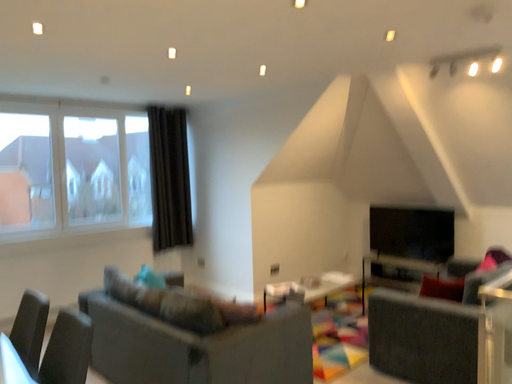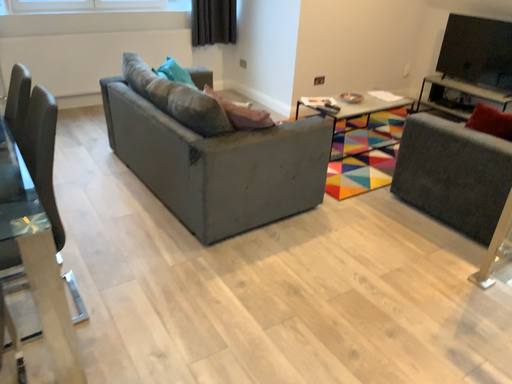
Question: Which way did the camera rotate in the video?

Choices:
 (A) rotated left
 (B) rotated right

Answer: (A)